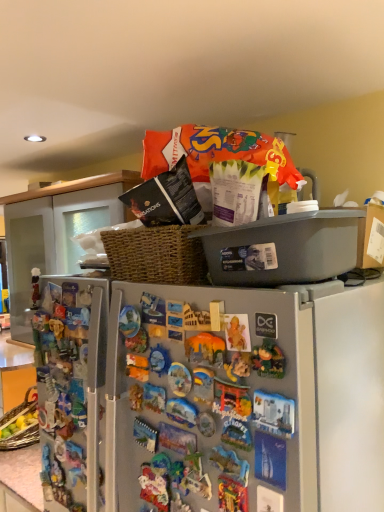
Question: From a real-world perspective, is metallic gray refrigerator at center located beneath matte plastic figurine at left, which is the 2th toy in front-to-back order?

Choices:
 (A) yes
 (B) no

Answer: (A)

Question: Does metallic gray refrigerator at center have a greater height compared to matte plastic figurine at left, positioned as the 1th toy in back-to-front order?

Choices:
 (A) no
 (B) yes

Answer: (B)

Question: Is metallic gray refrigerator at center aimed at matte plastic figurine at left, arranged as the 2th toy when viewed from the right?

Choices:
 (A) yes
 (B) no

Answer: (A)

Question: Can you confirm if metallic gray refrigerator at center is positioned to the right of matte plastic figurine at left, the 1th toy when ordered from left to right?

Choices:
 (A) no
 (B) yes

Answer: (B)

Question: Does metallic gray refrigerator at center come behind matte plastic figurine at left, the 1th toy when ordered from left to right?

Choices:
 (A) yes
 (B) no

Answer: (A)

Question: From a real-world perspective, is matte plastic figurine at left, positioned as the 1th toy in back-to-front order, physically located above or below matte orange toy at center, which is counted as the 1th toy, starting from the front?

Choices:
 (A) below
 (B) above

Answer: (B)

Question: From the image's perspective, is matte plastic figurine at left, positioned as the 1th toy in back-to-front order, located above or below matte orange toy at center, which is counted as the 1th toy, starting from the front?

Choices:
 (A) below
 (B) above

Answer: (B)

Question: From their relative heights in the image, would you say matte plastic figurine at left, arranged as the 2th toy when viewed from the right, is taller or shorter than matte orange toy at center, which is counted as the 1th toy, starting from the front?

Choices:
 (A) short
 (B) tall

Answer: (B)

Question: Considering the positions of matte plastic figurine at left, positioned as the 1th toy in back-to-front order, and matte orange toy at center, the 2th toy positioned from the left, in the image, is matte plastic figurine at left, positioned as the 1th toy in back-to-front order, wider or thinner than matte orange toy at center, the 2th toy positioned from the left,?

Choices:
 (A) thin
 (B) wide

Answer: (B)

Question: Looking at their shapes, would you say metallic gray refrigerator at center is wider or thinner than matte orange toy at center, which is the 2th toy in back-to-front order?

Choices:
 (A) wide
 (B) thin

Answer: (A)

Question: Is metallic gray refrigerator at center inside or outside of matte orange toy at center, positioned as the 1th toy in right-to-left order?

Choices:
 (A) inside
 (B) outside

Answer: (B)

Question: Relative to matte orange toy at center, the 2th toy positioned from the left, is metallic gray refrigerator at center in front or behind?

Choices:
 (A) behind
 (B) front

Answer: (A)

Question: From a real-world perspective, is metallic gray refrigerator at center physically located above or below matte orange toy at center, the 2th toy positioned from the left?

Choices:
 (A) above
 (B) below

Answer: (B)

Question: Considering the positions of point (33, 293) and point (203, 437), is point (33, 293) closer or farther from the camera than point (203, 437)?

Choices:
 (A) closer
 (B) farther

Answer: (B)

Question: Looking at their shapes, would you say matte plastic figurine at left, positioned as the 1th toy in back-to-front order, is wider or thinner than metallic gray refrigerator at center?

Choices:
 (A) thin
 (B) wide

Answer: (A)